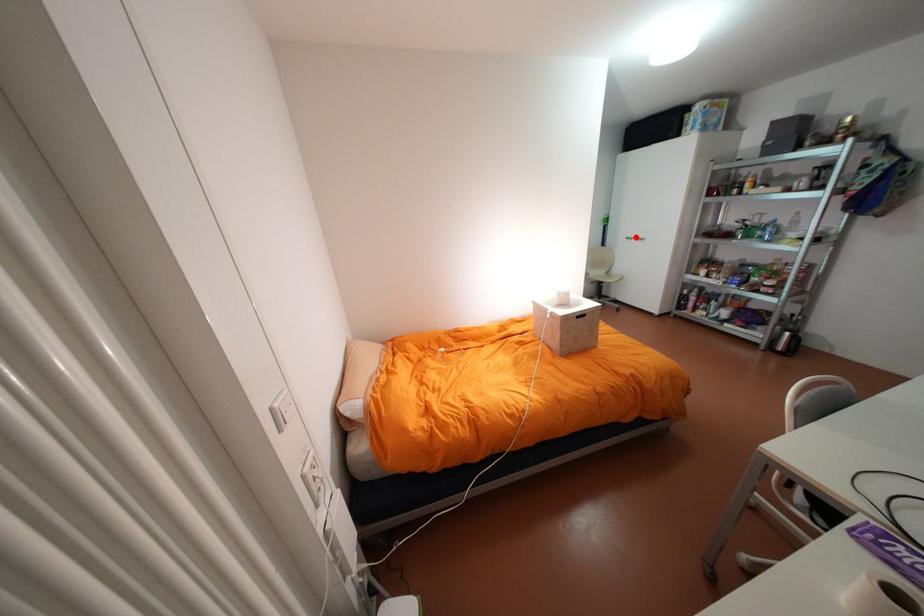
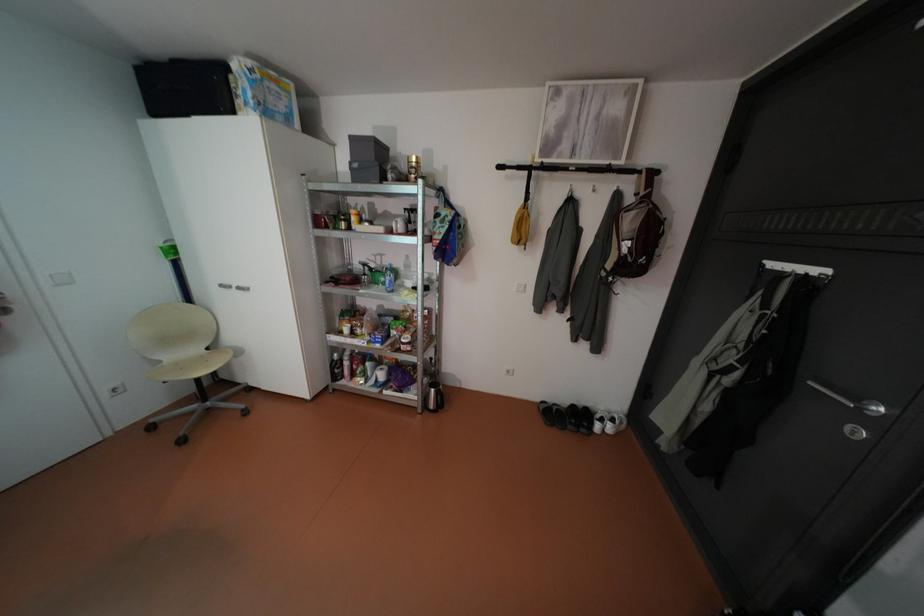
Question: A red point is marked in image1. In image2, is the corresponding 3D point closer to the camera or farther? Reply with the corresponding letter.

Choices:
 (A) The corresponding 3D point is closer.
 (B) The corresponding 3D point is farther.

Answer: (B)